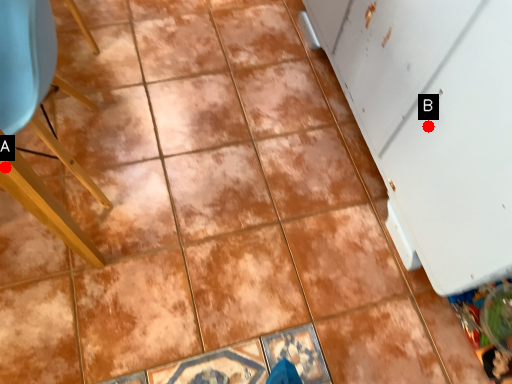
Question: Two points are circled on the image, labeled by A and B beside each circle. Which point is further to the camera?

Choices:
 (A) A is further
 (B) B is further

Answer: (B)